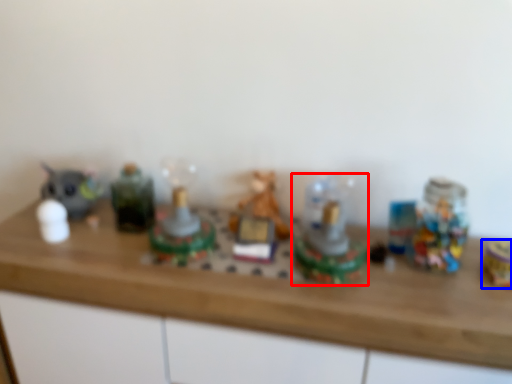
Question: Which object is closer to the camera taking this photo, toy (highlighted by a red box) or toy (highlighted by a blue box)?

Choices:
 (A) toy
 (B) toy

Answer: (A)